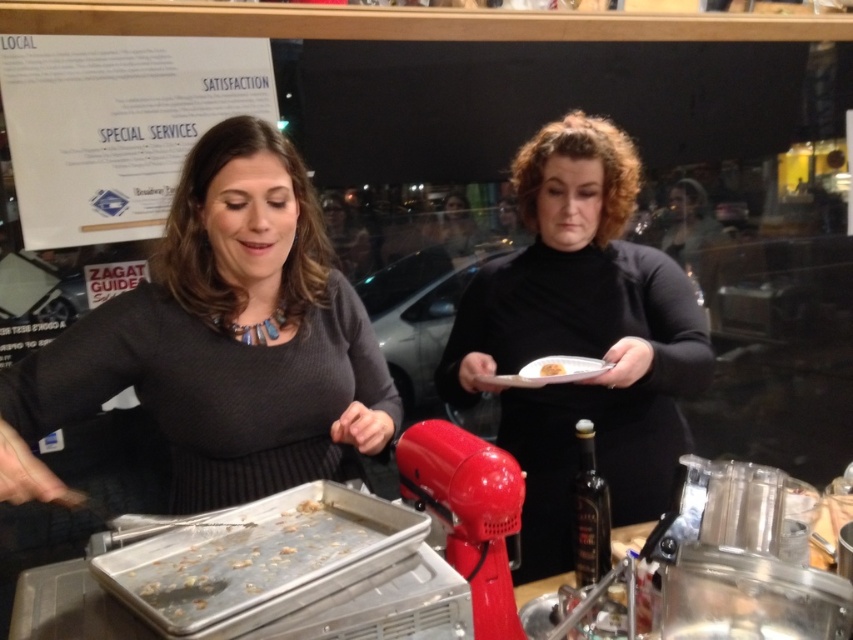
Between dark gray ribbed sweater at center and yellow matte bread at center, which one appears on the right side from the viewer's perspective?

Positioned to the right is yellow matte bread at center.

Is point (215, 160) positioned before point (544, 364)?

Yes, it is in front of point (544, 364).

What are the coordinates of `dark gray ribbed sweater at center` in the screenshot? It's located at (219, 340).

Is black matte dress at center in front of yellow matte bread at center?

Yes, it is.

Can you confirm if black matte dress at center is positioned below yellow matte bread at center?

No, black matte dress at center is not below yellow matte bread at center.

Where is `black matte dress at center`? The height and width of the screenshot is (640, 853). black matte dress at center is located at coordinates (581, 337).

Where is `dark gray ribbed sweater at center`? dark gray ribbed sweater at center is located at coordinates (219, 340).

Who is taller, dark gray ribbed sweater at center or black matte dress at center?

black matte dress at center is taller.

In order to click on dark gray ribbed sweater at center in this screenshot , I will do `click(219, 340)`.